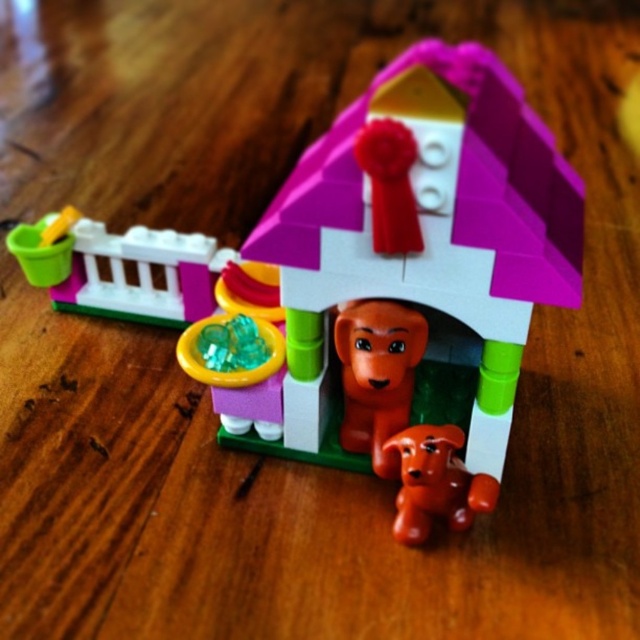
You are a child trying to find the smooth plastic bucket at left in the LEGO Duplo set. Based on the coordinates provided, can you determine its exact location relative to the wooden surface?

The smooth plastic bucket at left is located at coordinates point (122, 269) on the wooden surface.

You are trying to decide which object to pick up first. The smooth plastic bucket at left and the matte orange doll at center are both on the wooden surface. Based on their heights, which one do you think is taller?

The smooth plastic bucket at left is taller than the matte orange doll at center according to the description.